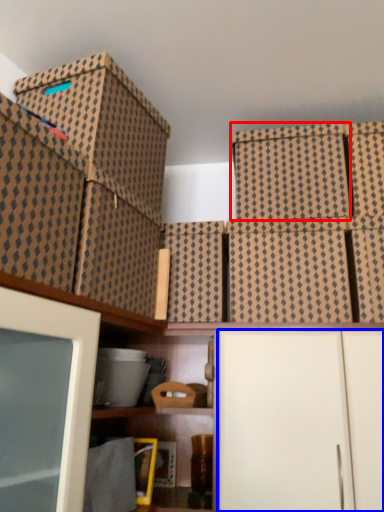
Question: Which point is further to the camera, storage box (highlighted by a red box) or cabinetry (highlighted by a blue box)?

Choices:
 (A) storage box
 (B) cabinetry

Answer: (A)